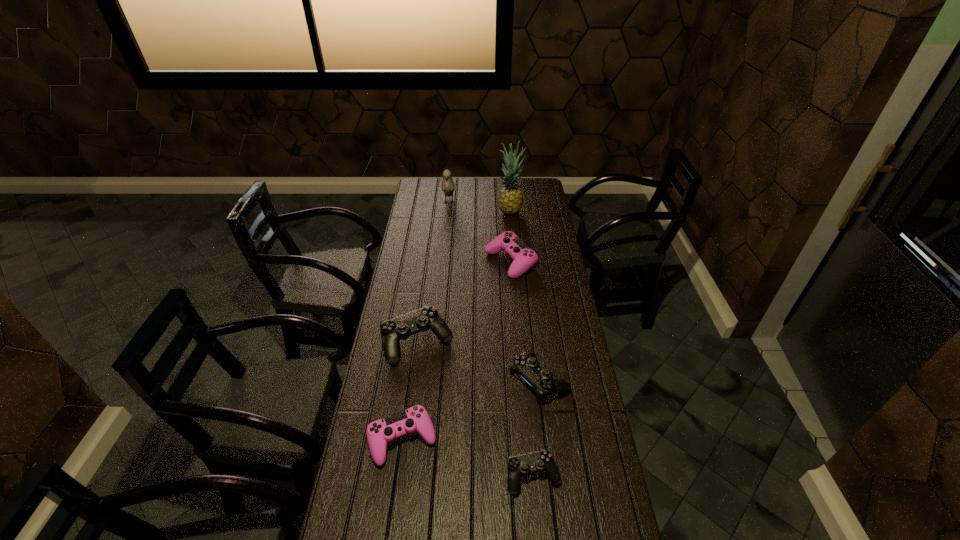
Identify the location of the closest black control to the right pink control. Image resolution: width=960 pixels, height=540 pixels. (401, 327).

Where is `pink control that is the second closest one to the nearest black control`? pink control that is the second closest one to the nearest black control is located at coordinates (524, 258).

The height and width of the screenshot is (540, 960). What are the coordinates of `vacant region that satisfies the following two spatial constraints: 1. on the front side of the nearest black control; 2. on the right side of the nearer pink control` in the screenshot? It's located at (397, 476).

Find the location of a particular element. The height and width of the screenshot is (540, 960). free space that satisfies the following two spatial constraints: 1. on the front side of the farther pink control; 2. on the right side of the nearest black control is located at coordinates (x=529, y=476).

Where is `vacant space that satisfies the following two spatial constraints: 1. on the front side of the shortest object; 2. on the left side of the biggest black control`? This screenshot has width=960, height=540. vacant space that satisfies the following two spatial constraints: 1. on the front side of the shortest object; 2. on the left side of the biggest black control is located at coordinates (399, 476).

I want to click on free spot that satisfies the following two spatial constraints: 1. on the back side of the smallest black control; 2. on the left side of the second biggest black control, so click(524, 380).

Locate an element on the screen. The height and width of the screenshot is (540, 960). blank space that satisfies the following two spatial constraints: 1. on the front side of the yellow pineapple; 2. on the right side of the second biggest black control is located at coordinates (526, 380).